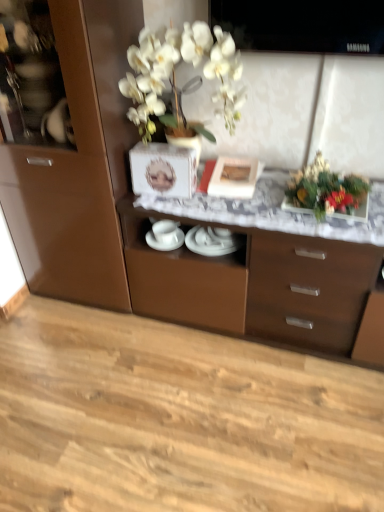
Locate an element on the screen. free point above brown glossy cabinet at center (from a real-world perspective) is located at coordinates (249, 195).